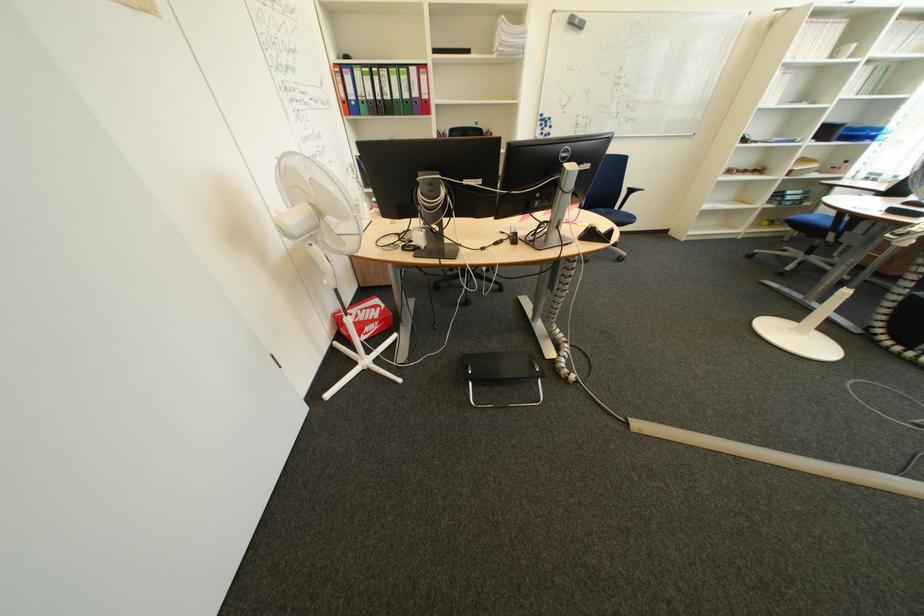
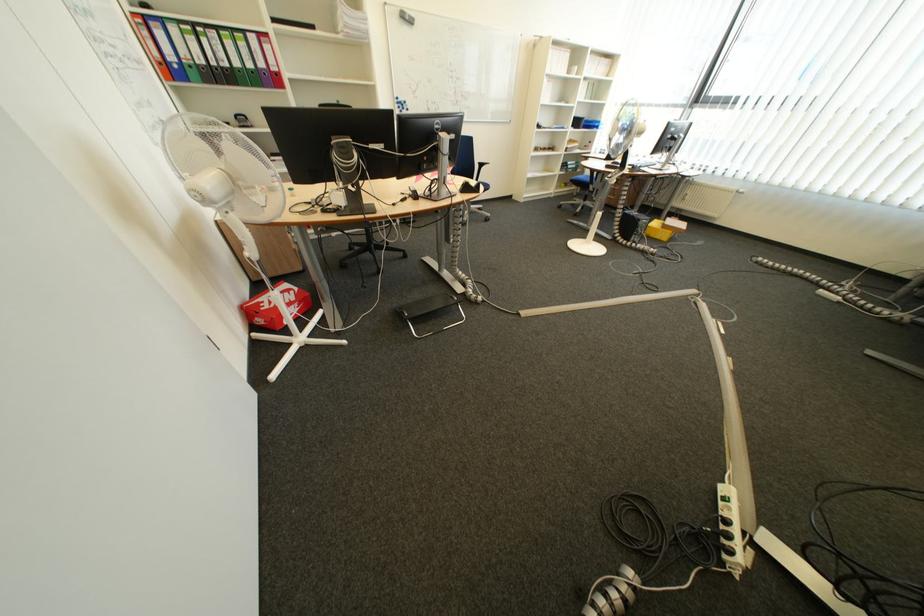
In a continuous first-person perspective shot, in which direction is the camera moving?

The cameraman walked toward left, backward.